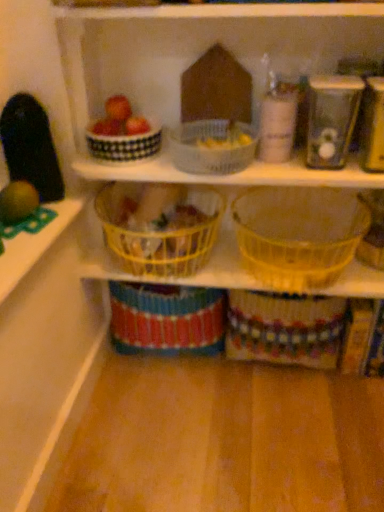
Question: Can you confirm if yellow plastic basket at center, the third basket viewed from the right, is positioned to the right of translucent plastic basket at center, acting as the first basket starting from the right?

Choices:
 (A) no
 (B) yes

Answer: (A)

Question: Is yellow plastic basket at center, the third basket viewed from the right, located outside translucent plastic basket at center, positioned as the fourth basket in left-to-right order?

Choices:
 (A) yes
 (B) no

Answer: (A)

Question: Is yellow plastic basket at center, placed as the second basket when sorted from left to right, further to camera compared to translucent plastic basket at center, positioned as the fourth basket in left-to-right order?

Choices:
 (A) yes
 (B) no

Answer: (A)

Question: Is yellow plastic basket at center, placed as the second basket when sorted from left to right, with translucent plastic basket at center, acting as the first basket starting from the right?

Choices:
 (A) yes
 (B) no

Answer: (B)

Question: From a real-world perspective, is yellow plastic basket at center, the third basket viewed from the right, located beneath translucent plastic basket at center, acting as the first basket starting from the right?

Choices:
 (A) no
 (B) yes

Answer: (B)

Question: Choose the correct answer: Is translucent plastic basket at center, positioned as the fourth basket in left-to-right order, inside metallic silver toaster at upper right, marked as the first appliance in a right-to-left arrangement, or outside it?

Choices:
 (A) outside
 (B) inside

Answer: (A)

Question: Does point (291, 224) appear closer or farther from the camera than point (367, 129)?

Choices:
 (A) farther
 (B) closer

Answer: (A)

Question: Relative to metallic silver toaster at upper right, which ranks as the 2th appliance in left-to-right order, is translucent plastic basket at center, positioned as the fourth basket in left-to-right order, in front or behind?

Choices:
 (A) front
 (B) behind

Answer: (B)

Question: From a real-world perspective, is translucent plastic basket at center, acting as the first basket starting from the right, physically located above or below metallic silver toaster at upper right, which ranks as the 2th appliance in left-to-right order?

Choices:
 (A) below
 (B) above

Answer: (A)

Question: Is translucent plastic basket at center, which is the second basket from right to left, wider or thinner than metallic silver canister at upper right, which is the first appliance in left-to-right order?

Choices:
 (A) wide
 (B) thin

Answer: (A)

Question: From their relative heights in the image, would you say translucent plastic basket at center, placed as the third basket when sorted from left to right, is taller or shorter than metallic silver canister at upper right, which is the first appliance in left-to-right order?

Choices:
 (A) short
 (B) tall

Answer: (A)

Question: From the image's perspective, relative to metallic silver canister at upper right, which is counted as the 2th appliance, starting from the right, is translucent plastic basket at center, which is the second basket from right to left, above or below?

Choices:
 (A) below
 (B) above

Answer: (A)

Question: In terms of size, does translucent plastic basket at center, which is the second basket from right to left, appear bigger or smaller than metallic silver canister at upper right, which is the first appliance in left-to-right order?

Choices:
 (A) small
 (B) big

Answer: (B)

Question: Considering the positions of point (329, 79) and point (198, 250), is point (329, 79) closer or farther from the camera than point (198, 250)?

Choices:
 (A) farther
 (B) closer

Answer: (B)

Question: Is metallic silver canister at upper right, which is counted as the 2th appliance, starting from the right, inside the boundaries of yellow plastic basket at center, placed as the second basket when sorted from left to right, or outside?

Choices:
 (A) outside
 (B) inside

Answer: (A)